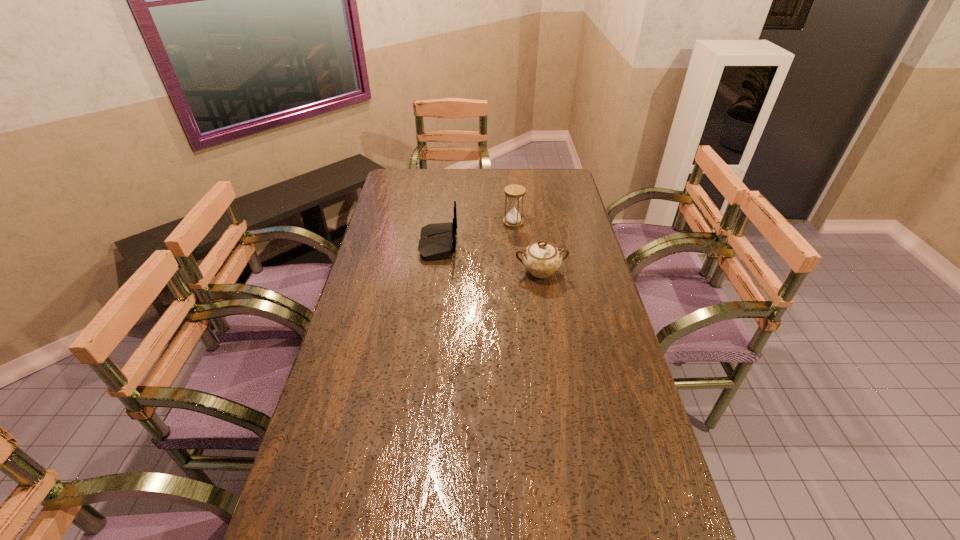
Find the location of a particular element. The width and height of the screenshot is (960, 540). hourglass is located at coordinates (514, 193).

Find the location of `router`. router is located at coordinates (438, 240).

Image resolution: width=960 pixels, height=540 pixels. I want to click on chinaware, so click(x=541, y=259).

Find the location of a particular element. free space located 0.280m on the front of the hourglass is located at coordinates (518, 275).

You are a GUI agent. You are given a task and a screenshot of the screen. Output one action in this format:
    pyautogui.click(x=<x>, y=<y>)
    Task: Click on the free space located 0.180m on the back of the router
    The height and width of the screenshot is (540, 960).
    Given the screenshot: What is the action you would take?
    pyautogui.click(x=505, y=245)

Where is `free space located 0.370m on the back of the chinaware`? free space located 0.370m on the back of the chinaware is located at coordinates (530, 205).

Where is `object located at the right edge`? This screenshot has width=960, height=540. object located at the right edge is located at coordinates (541, 259).

The height and width of the screenshot is (540, 960). In the image, there is a desktop. Identify the location of vacant region at the left edge. (370, 342).

This screenshot has width=960, height=540. In the image, there is a desktop. What are the coordinates of `vacant space at the right edge` in the screenshot? It's located at (579, 358).

Find the location of `vacant space at the far left corner of the desktop`. vacant space at the far left corner of the desktop is located at coordinates (396, 187).